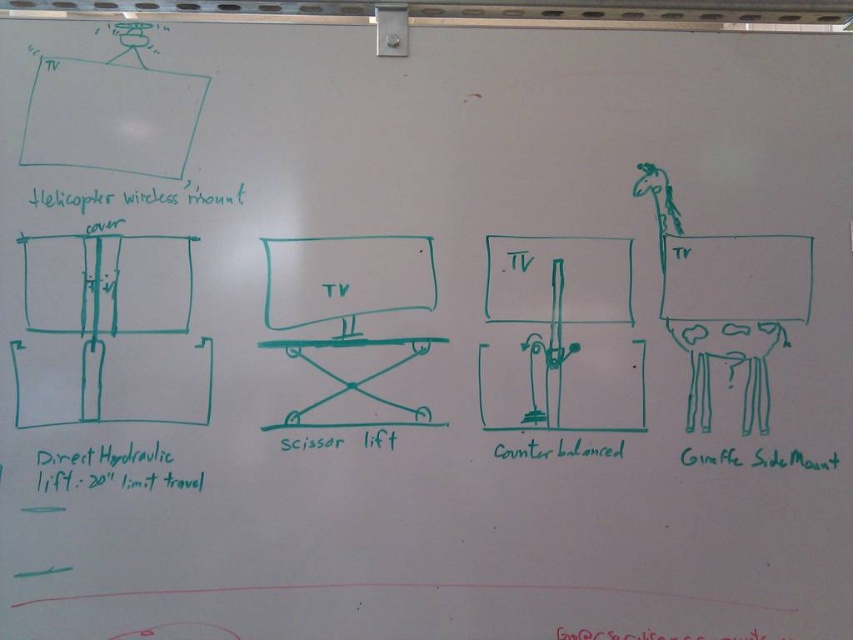
Question: Is green matte giraffe side mount at right positioned at the back of counterbalanced at center?

Choices:
 (A) no
 (B) yes

Answer: (A)

Question: Is green matte giraffe side mount at right above counterbalanced at center?

Choices:
 (A) no
 (B) yes

Answer: (A)

Question: Estimate the real-world distances between objects in this image. Which object is farther from the red ink writing at lower center?

Choices:
 (A) direct hydraulic lift at lower left
 (B) green matte giraffe side mount at right
 (C) green handwritten text at upper left
 (D) counterbalanced at center

Answer: (C)

Question: Among these points, which one is nearest to the camera?

Choices:
 (A) (738, 458)
 (B) (117, 449)

Answer: (B)

Question: Which object is farther from the camera taking this photo?

Choices:
 (A) direct hydraulic lift at lower left
 (B) green handwritten text at upper left
 (C) counterbalanced at center
 (D) red ink writing at lower center

Answer: (C)

Question: Is green handwritten text at upper left wider than counterbalanced at center?

Choices:
 (A) no
 (B) yes

Answer: (B)